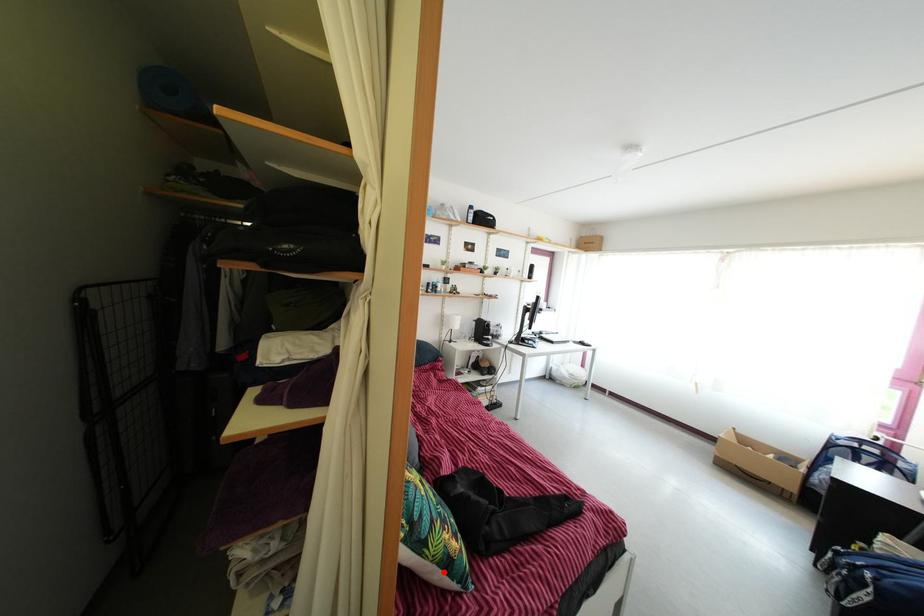
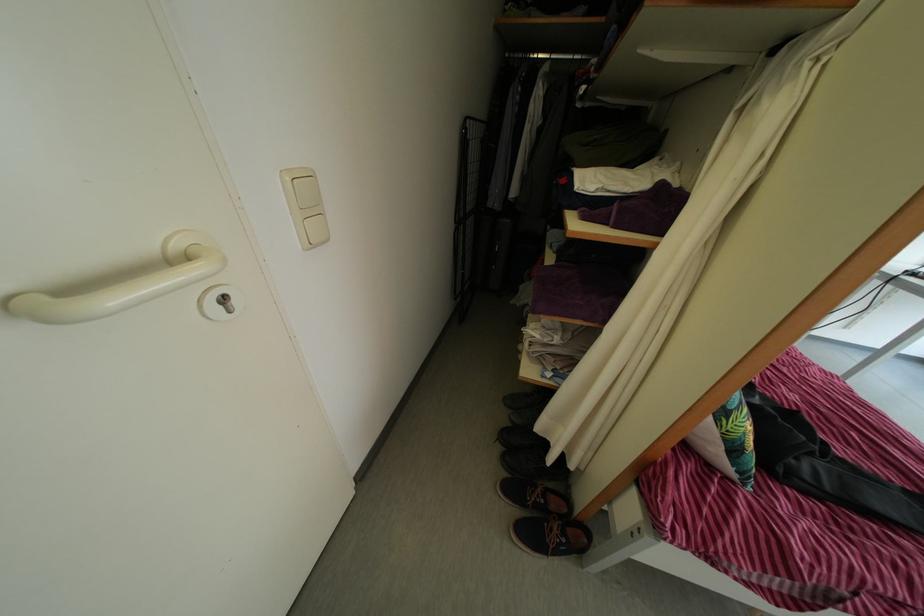
The point at the highlighted location is marked in the first image. Where is the corresponding point in the second image?

(732, 448)